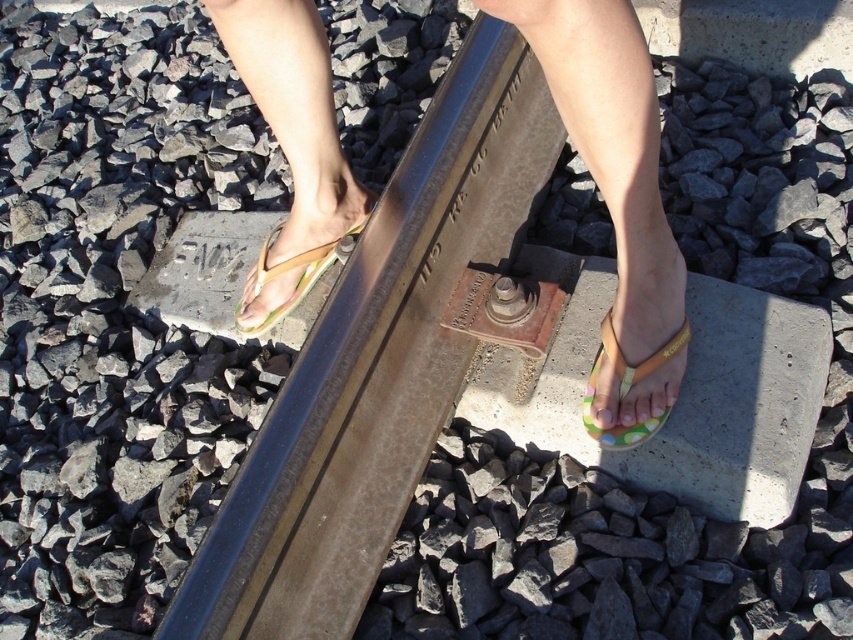
Question: Which object appears closest to the camera in this image?

Choices:
 (A) yellow rubber flip-flop at center
 (B) polka dot flip-flops at center
 (C) smooth concrete block at center
 (D) multicolored plastic flip-flop at center

Answer: (B)

Question: Is smooth concrete block at center smaller than multicolored plastic flip-flop at center?

Choices:
 (A) no
 (B) yes

Answer: (A)

Question: Does polka dot flip-flops at center have a smaller size compared to smooth concrete block at center?

Choices:
 (A) yes
 (B) no

Answer: (A)

Question: Is smooth concrete block at center to the left of multicolored plastic flip-flop at center from the viewer's perspective?

Choices:
 (A) no
 (B) yes

Answer: (A)

Question: Which point appears closest to the camera in this image?

Choices:
 (A) (253, 330)
 (B) (596, 368)
 (C) (526, 358)

Answer: (B)

Question: Which is farther from the multicolored plastic flip-flop at center?

Choices:
 (A) smooth concrete block at center
 (B) yellow rubber flip-flop at center

Answer: (B)